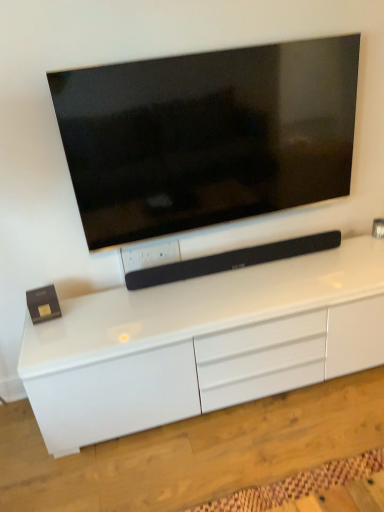
Locate an element on the screen. The image size is (384, 512). matte black tv at upper center is located at coordinates [207, 136].

You are a GUI agent. You are given a task and a screenshot of the screen. Output one action in this format:
    pyautogui.click(x=<x>, y=<y>)
    Task: Click on the white glossy cabinet at center
    The image size is (384, 512).
    Given the screenshot: What is the action you would take?
    pyautogui.click(x=202, y=344)

What is the approximate height of black matte soundbar at center?

black matte soundbar at center is 4.15 inches in height.

Find the location of `matte black tv at upper center`. matte black tv at upper center is located at coordinates (207, 136).

Which of these two, black matte soundbar at center or white glossy cabinet at center, is wider?

white glossy cabinet at center is wider.

From a real-world perspective, is black matte soundbar at center positioned under white glossy cabinet at center based on gravity?

No.

Does black matte soundbar at center appear on the right side of white glossy cabinet at center?

Incorrect, black matte soundbar at center is not on the right side of white glossy cabinet at center.

Could you tell me if black matte soundbar at center is facing white glossy cabinet at center?

No, black matte soundbar at center is not facing towards white glossy cabinet at center.

Is white glossy cabinet at center completely or partially outside of black matte soundbar at center?

Yes, white glossy cabinet at center is located beyond the bounds of black matte soundbar at center.

Which object is further away from the camera, white glossy cabinet at center or black matte soundbar at center?

black matte soundbar at center is further away from the camera.

Considering the relative sizes of white glossy cabinet at center and black matte soundbar at center in the image provided, is white glossy cabinet at center thinner than black matte soundbar at center?

In fact, white glossy cabinet at center might be wider than black matte soundbar at center.

Locate an element on the screen. The width and height of the screenshot is (384, 512). equipment above the white glossy cabinet at center (from the image's perspective) is located at coordinates (231, 260).

Is white glossy cabinet at center smaller than matte black tv at upper center?

Incorrect, white glossy cabinet at center is not smaller in size than matte black tv at upper center.

Locate an element on the screen. The image size is (384, 512). television above the white glossy cabinet at center (from a real-world perspective) is located at coordinates (207, 136).

Is white glossy cabinet at center taller or shorter than matte black tv at upper center?

In the image, white glossy cabinet at center appears to be shorter than matte black tv at upper center.

Does black matte soundbar at center touch matte black tv at upper center?

black matte soundbar at center and matte black tv at upper center are clearly separated.

Choose the correct answer: Is black matte soundbar at center inside matte black tv at upper center or outside it?

black matte soundbar at center is not inside matte black tv at upper center, it's outside.

Between black matte soundbar at center and matte black tv at upper center, which one has smaller size?

black matte soundbar at center is smaller.

Which of these two, black matte soundbar at center or matte black tv at upper center, is thinner?

With smaller width is matte black tv at upper center.

From a real-world perspective, who is located lower, matte black tv at upper center or black matte soundbar at center?

In real-world perspective, black matte soundbar at center is lower.

Looking at their sizes, would you say matte black tv at upper center is wider or thinner than black matte soundbar at center?

Clearly, matte black tv at upper center has less width compared to black matte soundbar at center.

Considering the relative positions of matte black tv at upper center and black matte soundbar at center in the image provided, is matte black tv at upper center to the left of black matte soundbar at center from the viewer's perspective?

Yes, matte black tv at upper center is to the left of black matte soundbar at center.

From the picture: Does matte black tv at upper center lie in front of black matte soundbar at center?

Yes.

Is white glossy cabinet at center a part of matte black tv at upper center?

No, white glossy cabinet at center is located outside of matte black tv at upper center.

Is matte black tv at upper center facing away from white glossy cabinet at center?

No, matte black tv at upper center is not facing the opposite direction of white glossy cabinet at center.

Considering the relative sizes of matte black tv at upper center and white glossy cabinet at center in the image provided, is matte black tv at upper center smaller than white glossy cabinet at center?

Correct, matte black tv at upper center occupies less space than white glossy cabinet at center.

Is matte black tv at upper center beside white glossy cabinet at center?

There is a gap between matte black tv at upper center and white glossy cabinet at center.

Find the location of a particular element. Image resolution: width=384 pixels, height=512 pixels. equipment behind the white glossy cabinet at center is located at coordinates (231, 260).

The height and width of the screenshot is (512, 384). In order to click on cabinetry located underneath the black matte soundbar at center (from a real-world perspective) in this screenshot , I will do `click(202, 344)`.

Estimate the real-world distances between objects in this image. Which object is closer to white glossy cabinet at center, matte black tv at upper center or black matte soundbar at center?

Among the two, black matte soundbar at center is located nearer to white glossy cabinet at center.

Which object lies nearer to the anchor point matte black tv at upper center, black matte soundbar at center or white glossy cabinet at center?

The object closer to matte black tv at upper center is black matte soundbar at center.

From the image, which object appears to be nearer to white glossy cabinet at center, black matte soundbar at center or matte black tv at upper center?

The object closer to white glossy cabinet at center is black matte soundbar at center.

When comparing their distances from black matte soundbar at center, does white glossy cabinet at center or matte black tv at upper center seem closer?

Based on the image, white glossy cabinet at center appears to be nearer to black matte soundbar at center.

Looking at the image, which one is located closer to black matte soundbar at center, matte black tv at upper center or white glossy cabinet at center?

The object closer to black matte soundbar at center is white glossy cabinet at center.

Looking at the image, which one is located further to matte black tv at upper center, white glossy cabinet at center or black matte soundbar at center?

white glossy cabinet at center is further to matte black tv at upper center.

At what (x,y) coordinates should I click in order to perform the action: click on equipment that lies between matte black tv at upper center and white glossy cabinet at center from top to bottom. Please return your answer as a coordinate pair (x, y). The height and width of the screenshot is (512, 384). Looking at the image, I should click on (231, 260).